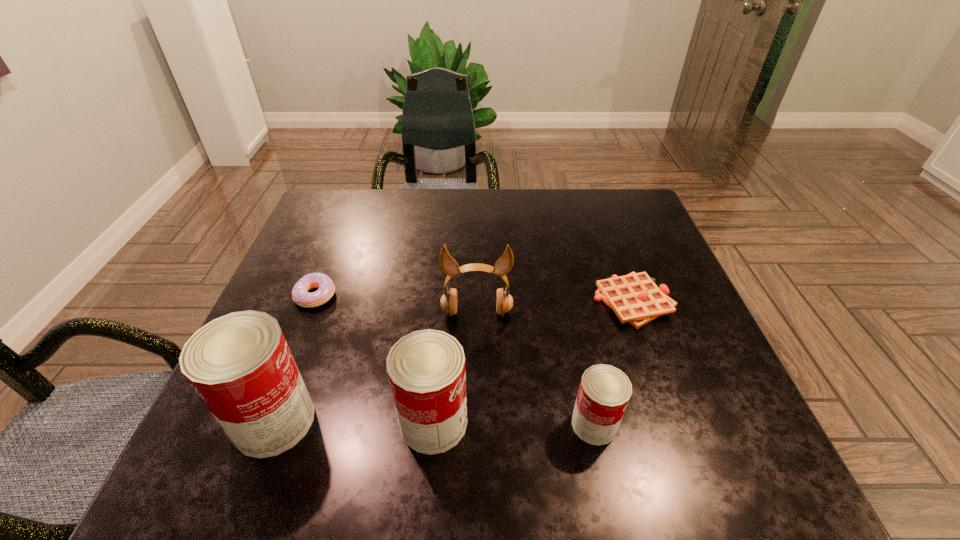
You are a GUI agent. You are given a task and a screenshot of the screen. Output one action in this format:
    pyautogui.click(x=<x>, y=<y>)
    Task: Click on the leftmost can
    This screenshot has height=540, width=960.
    Given the screenshot: What is the action you would take?
    pyautogui.click(x=240, y=365)

The width and height of the screenshot is (960, 540). Identify the location of the second can from left to right. (426, 369).

You are a GUI agent. You are given a task and a screenshot of the screen. Output one action in this format:
    pyautogui.click(x=<x>, y=<y>)
    Task: Click on the fourth tallest object
    
    Given the screenshot: What is the action you would take?
    pyautogui.click(x=604, y=392)

This screenshot has height=540, width=960. I want to click on the shortest can, so click(604, 392).

Find the location of a particular element. earphone is located at coordinates click(504, 302).

Where is `doughnut`? The image size is (960, 540). doughnut is located at coordinates (300, 295).

This screenshot has height=540, width=960. Identify the location of the rightmost object. (635, 298).

Where is `free space located on the front label of the second can from right to left`? The height and width of the screenshot is (540, 960). free space located on the front label of the second can from right to left is located at coordinates (563, 422).

Locate an element on the screen. The height and width of the screenshot is (540, 960). vacant space situated 0.070m on the front label of the shortest can is located at coordinates click(x=657, y=424).

At what (x,y) coordinates should I click in order to perform the action: click on vacant region located on the front-facing side of the earphone. Please return your answer as a coordinate pair (x, y). This screenshot has height=540, width=960. Looking at the image, I should click on (476, 360).